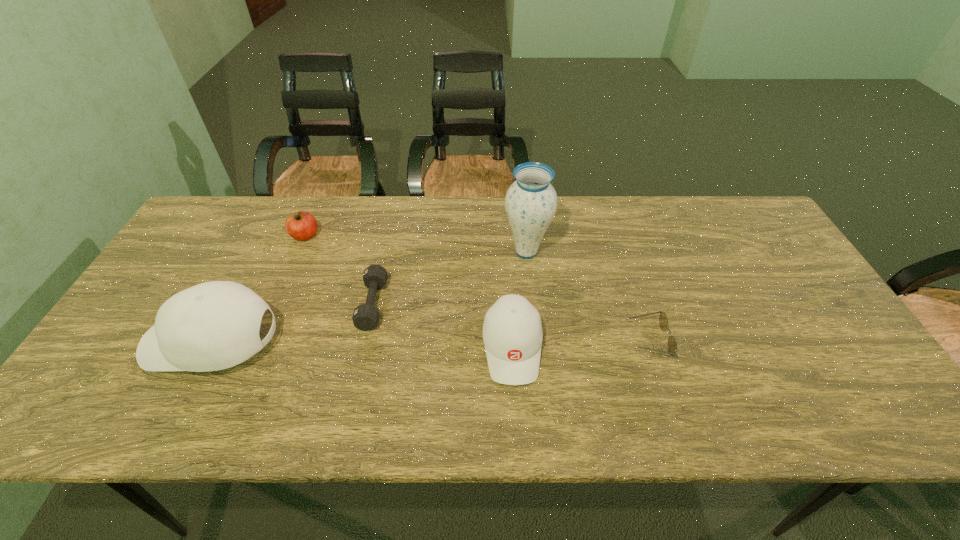
I want to click on vacant space that satisfies the following two spatial constraints: 1. on the back side of the third object from left to right; 2. on the right side of the tallest object, so click(384, 252).